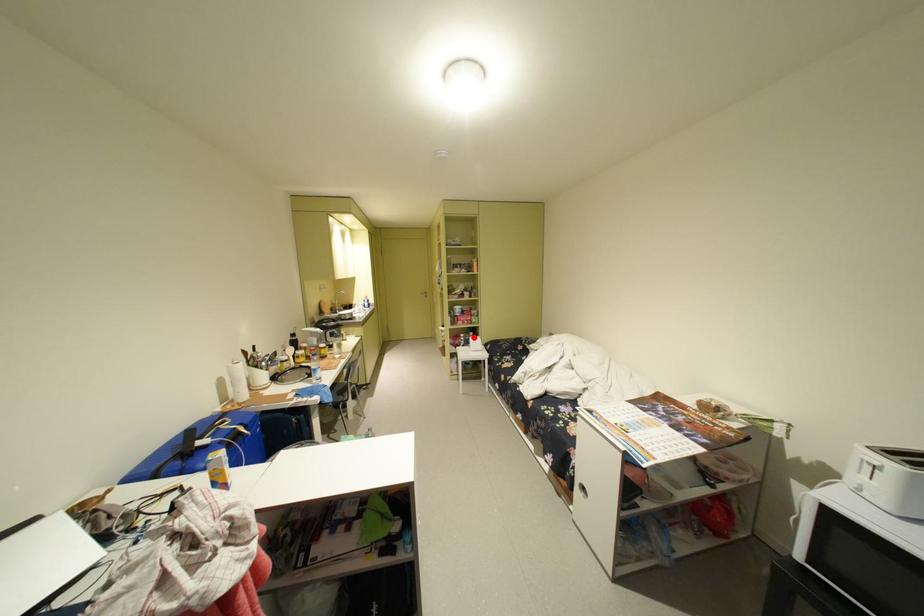
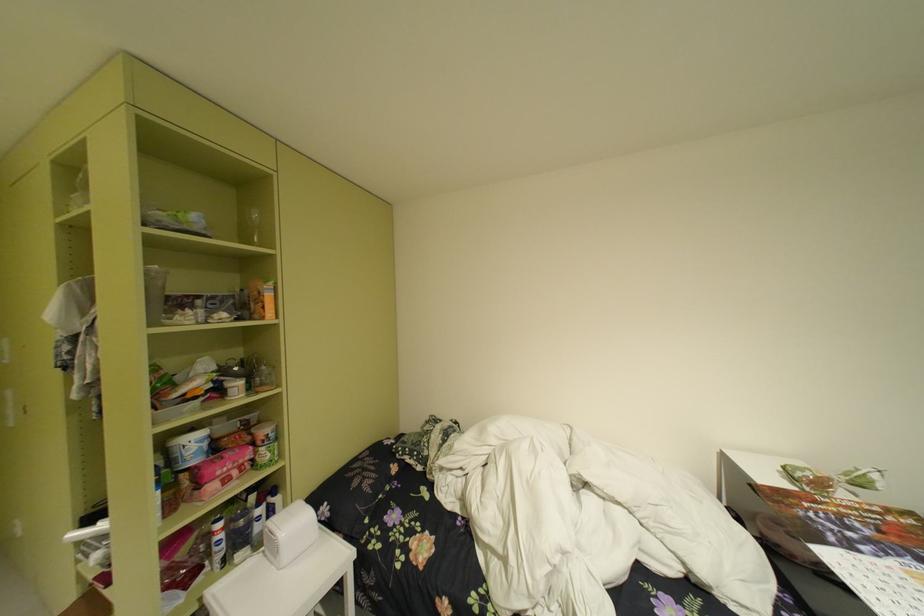
Find the pixel in the second image that matches the highlighted location in the first image.

(235, 528)